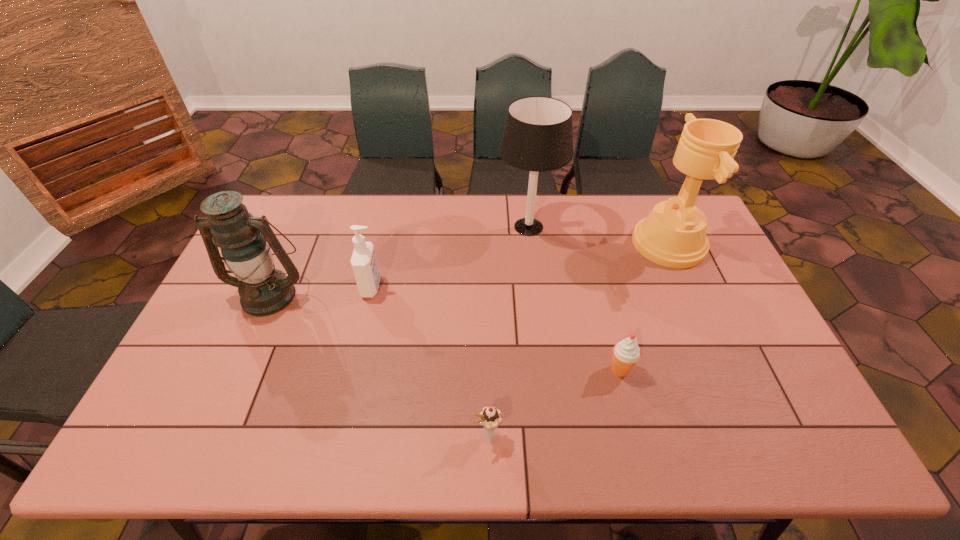
This screenshot has height=540, width=960. In order to click on vacant position in the image that satisfies the following two spatial constraints: 1. on the front label of the right icecream; 2. on the left side of the cleansing agent in this screenshot , I will do `click(352, 370)`.

Identify the location of vacant area in the image that satisfies the following two spatial constraints: 1. on the front label of the nearer icecream; 2. on the left side of the fourth tallest object. (337, 435).

Where is `vacant region that satisfies the following two spatial constraints: 1. on the back side of the rightmost object; 2. on the right side of the oil lamp`? This screenshot has height=540, width=960. vacant region that satisfies the following two spatial constraints: 1. on the back side of the rightmost object; 2. on the right side of the oil lamp is located at coordinates (292, 244).